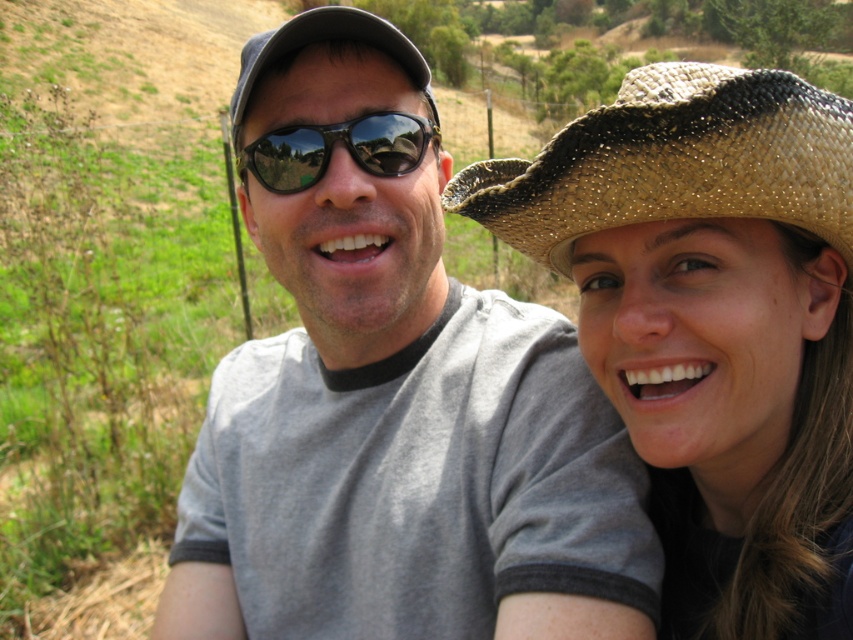
You are standing at the origin of the coordinate system in the image. You see two points, point [683,212] and point [262,140]. Which point is closer to you?

Point [262,140] is closer to you because it has a smaller y coordinate than point [683,212] in the image coordinate system.